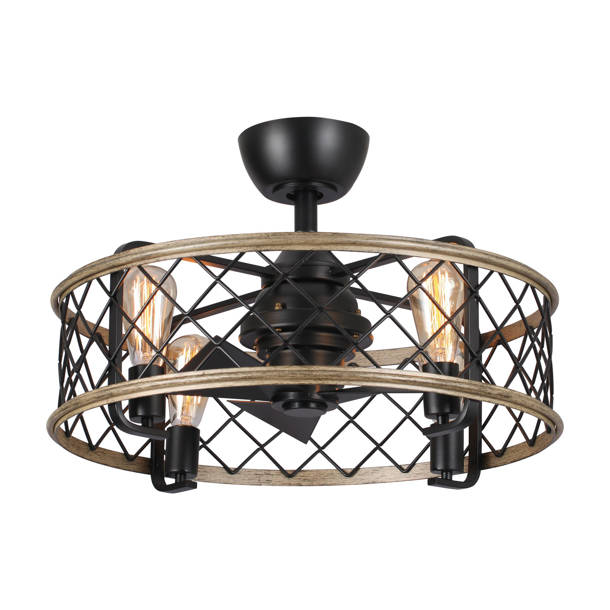
Where is `top of wooden frame`? This screenshot has width=610, height=610. top of wooden frame is located at coordinates (374, 240).